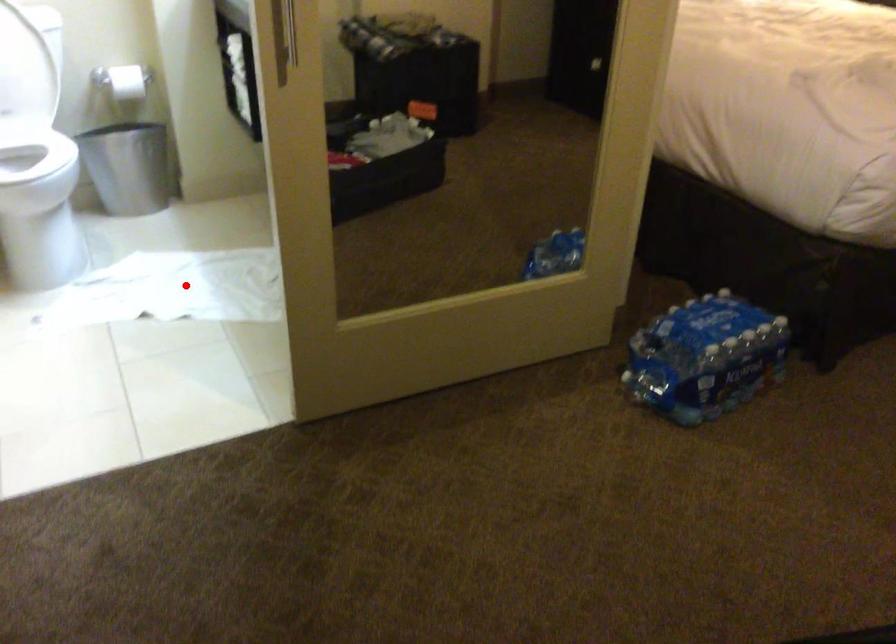
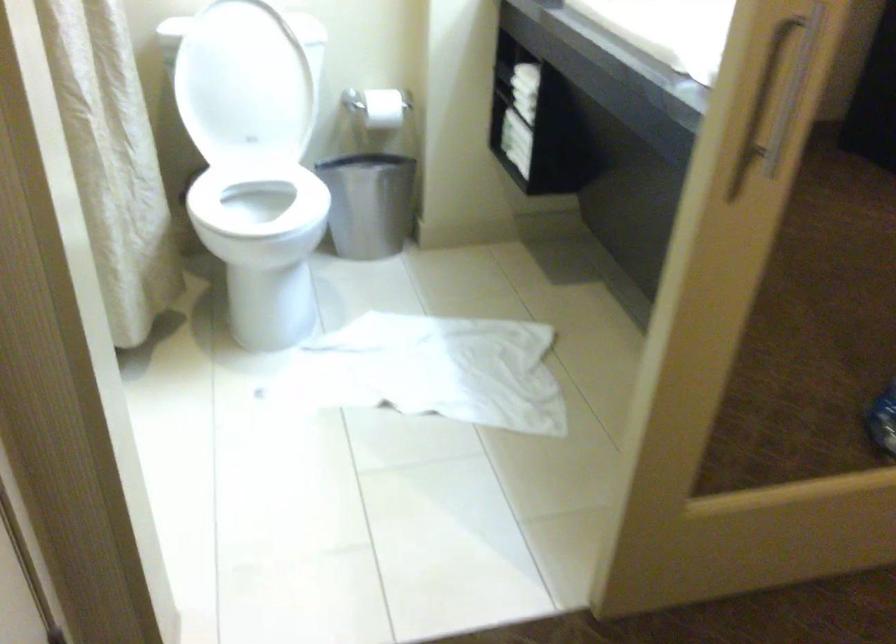
In the second image, find the point that corresponds to the highlighted location in the first image.

(429, 371)